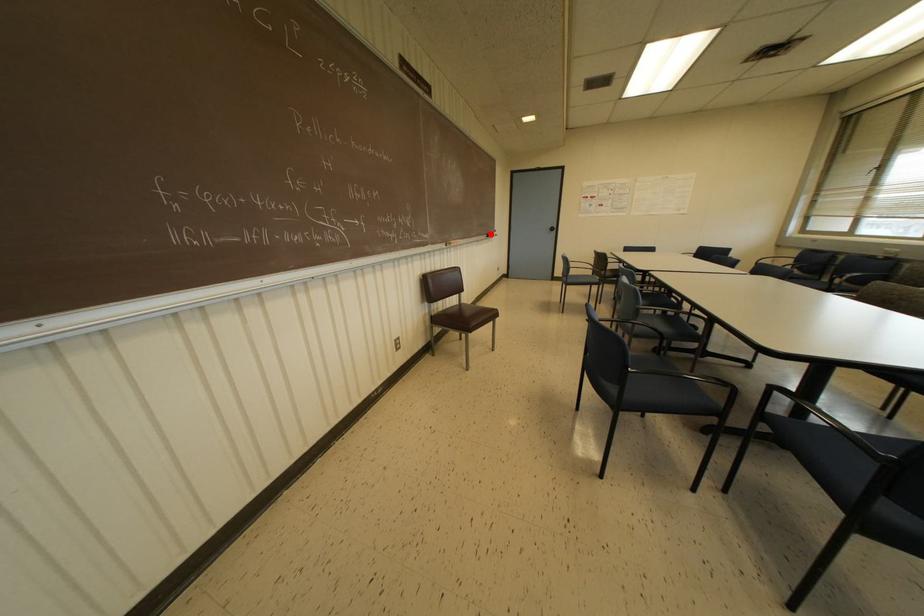
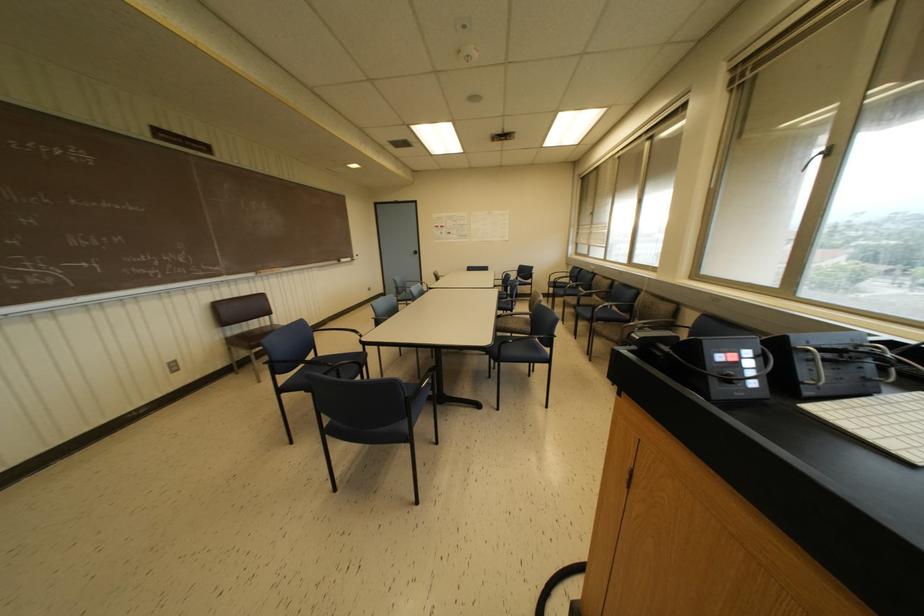
The point at the highlighted location is marked in the first image. Where is the corresponding point in the second image?

(342, 259)